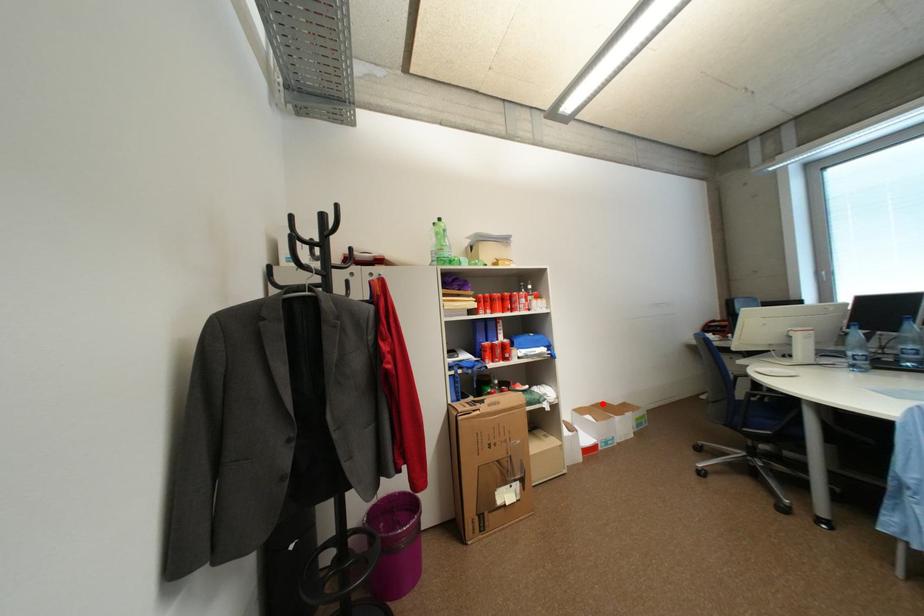
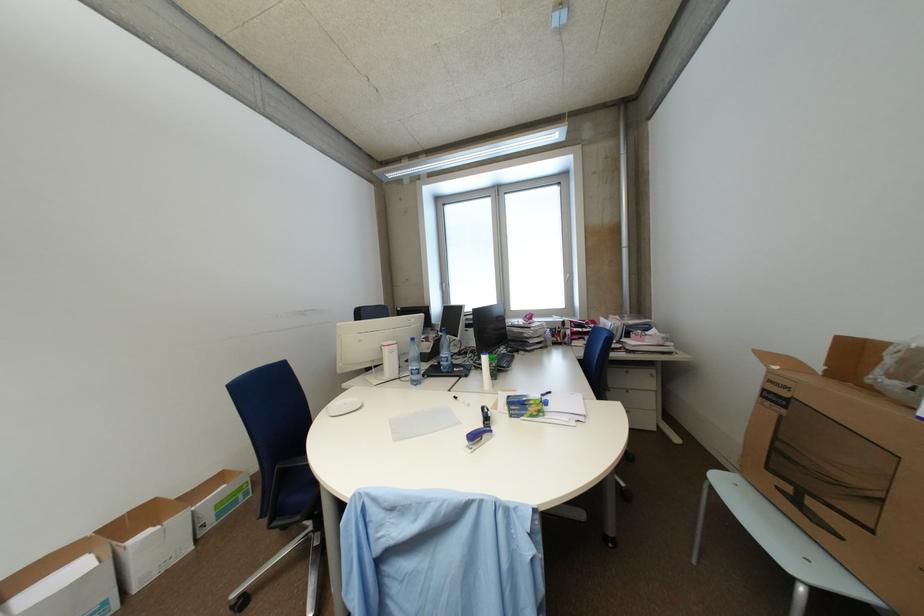
Question: I am providing you with two images of the same scene from different viewpoints. A red point is marked on the first image. At the location where the point appears in image 1, is it still visible in image 2?

Choices:
 (A) Yes
 (B) No

Answer: (A)